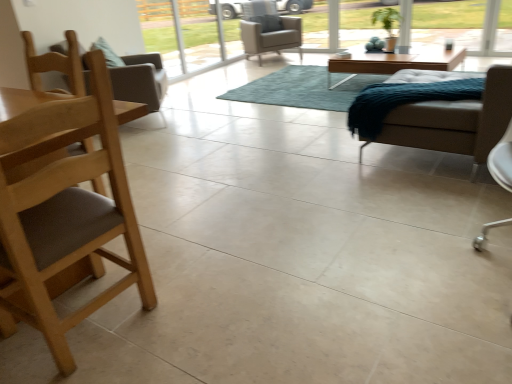
Question: From their relative heights in the image, would you say teal shaggy rug at center is taller or shorter than white leather chair at right, which appears as the third chair when viewed from the back?

Choices:
 (A) tall
 (B) short

Answer: (B)

Question: Is teal shaggy rug at center inside the boundaries of white leather chair at right, which appears as the 2th chair when viewed from the front, or outside?

Choices:
 (A) outside
 (B) inside

Answer: (A)

Question: Estimate the real-world distances between objects in this image. Which object is farther from the white leather chair at right, arranged as the 3th chair when viewed from the top?

Choices:
 (A) light brown wooden coffee table at center
 (B) transparent glass screen door at upper center
 (C) light brown leather armchair at center, the fourth chair ordered from the bottom
 (D) brown wood chair at left, which appears as the 4th chair when viewed from the back
 (E) teal shaggy rug at center

Answer: (B)

Question: Based on their relative distances, which object is nearer to the wooden chair at left, the 2th chair in the top-to-bottom sequence?

Choices:
 (A) white leather chair at right, which is the 2th chair in bottom-to-top order
 (B) teal shaggy rug at center
 (C) light brown leather armchair at center, which is the first chair in top-to-bottom order
 (D) transparent glass screen door at upper center
 (E) brown wood chair at left, which appears as the 4th chair when viewed from the back

Answer: (B)